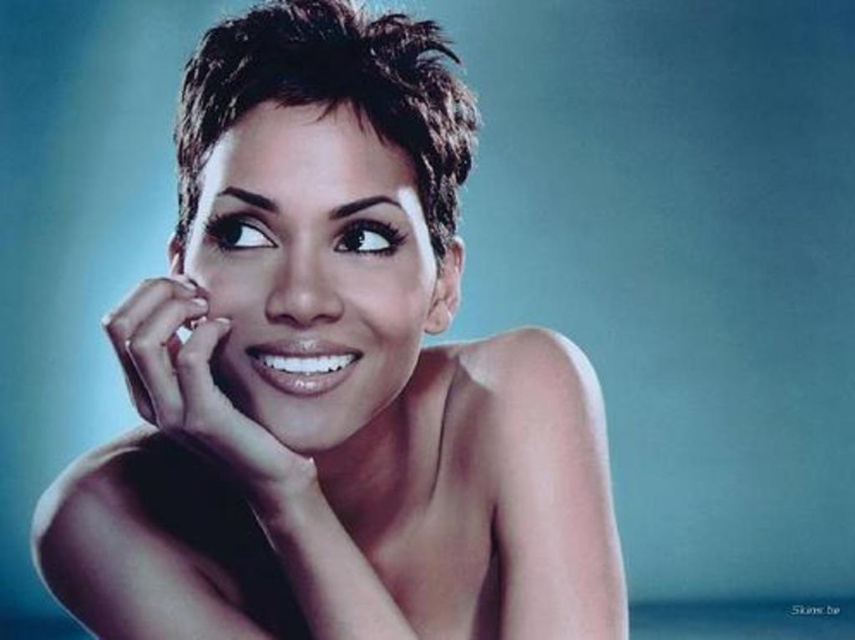
You are a photographer setting up a portrait shoot. The subject, a smooth skin woman at center, is positioned in front of you. You need to ensure that the camera is exactly 60 centimeters away from her to achieve the desired depth of field. Based on the current setup, is the camera positioned correctly?

The distance between the smooth skin woman at center and the camera is 55.80 centimeters, which is less than the required 60 centimeters. Therefore, the camera is too close and needs to be moved back to achieve the desired depth of field.

Based on the scene description, which object is closer to the viewer between the smooth skin woman at center and the dark brown textured hair at center?

The smooth skin woman at center is closer to the viewer than the dark brown textured hair at center.

You are a photographer setting up for a portrait session. You notice the dark brown textured hair at center and the smooth skin hand at center in the frame. Which object should you focus on if you want to emphasize the larger element in the composition?

You should focus on the dark brown textured hair at center because it is larger in size than the smooth skin hand at center, making it the dominant element in the composition.